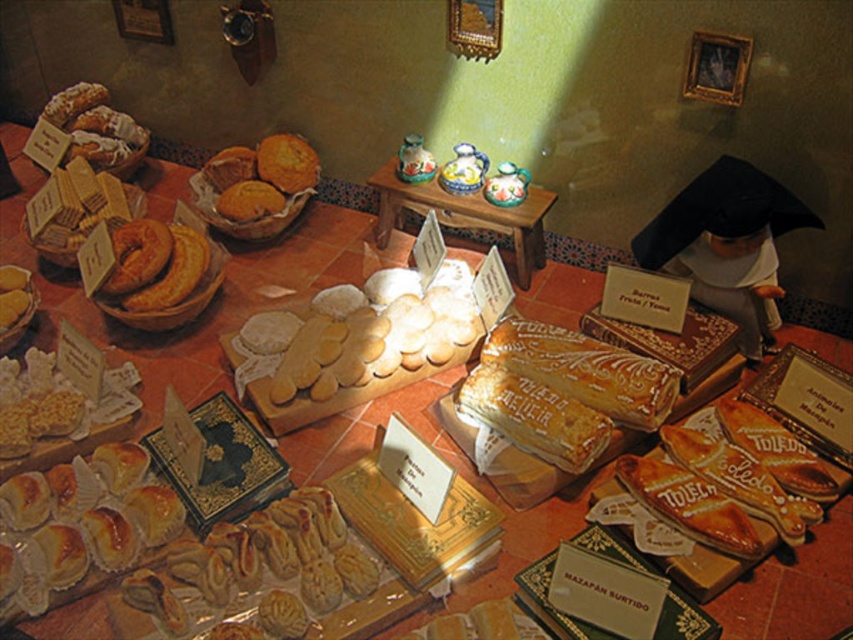
You are a customer at a bakery and want to place an order for both the wooden table at center and the golden crumbly muffins at center. However, you have a height restriction of 15 cm for the items you can take home. Can both items fit within this limit?

The wooden table at center is taller than the golden crumbly muffins at center. Since the table is taller than the muffins, and the height restriction is 15 cm, we need to check if both are under 15 cm. However, since the table is taller than the muffins, if the table exceeds 15 cm, the muffins might still be under. But without exact measurements, we can only say that if the table is over 15 cm, it won

You are a customer at the bakery and want to place an order for the golden crumbly muffins at center. The cashier asks you to point to the item on the table. Where should you look relative to the wooden table at center?

The golden crumbly muffins at center are to the left of the wooden table at center.